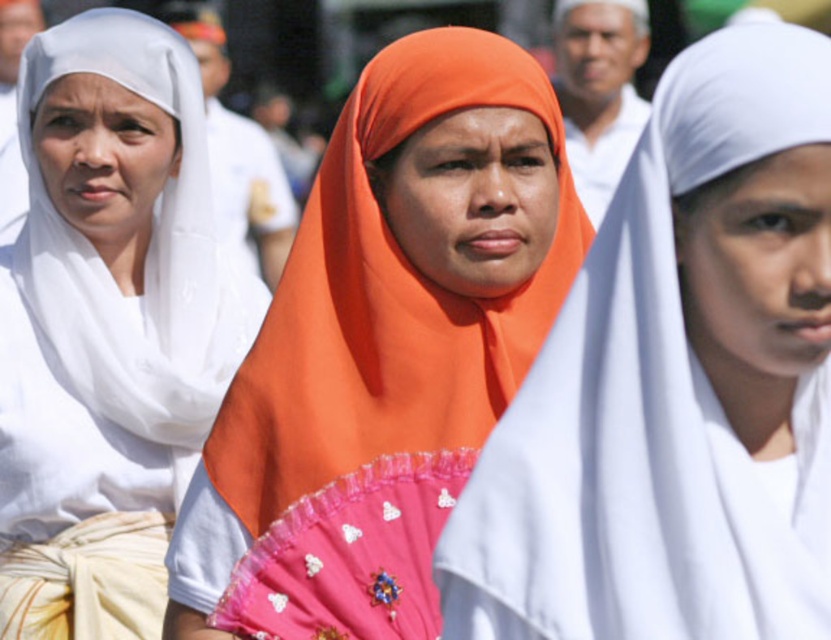
Which of these two, white matte veil at center or orange fabric headscarf at center, stands taller?

With more height is orange fabric headscarf at center.

Does white matte veil at center appear on the right side of orange fabric headscarf at center?

Indeed, white matte veil at center is positioned on the right side of orange fabric headscarf at center.

Is point (758, 224) less distant than point (552, 304)?

Yes.

Where is `white matte veil at center`? white matte veil at center is located at coordinates (676, 384).

Is point (182, 547) farther from camera compared to point (97, 129)?

No, it is in front of (97, 129).

Which is behind, point (426, 262) or point (163, 481)?

The point (163, 481) is more distant.

What do you see at coordinates (392, 296) in the screenshot? I see `orange fabric headscarf at center` at bounding box center [392, 296].

What are the coordinates of `orange fabric headscarf at center` in the screenshot? It's located at (392, 296).

Is white matte veil at center positioned before white matte scarf at left?

Yes, it is in front of white matte scarf at left.

Image resolution: width=831 pixels, height=640 pixels. What are the coordinates of `white matte veil at center` in the screenshot? It's located at (676, 384).